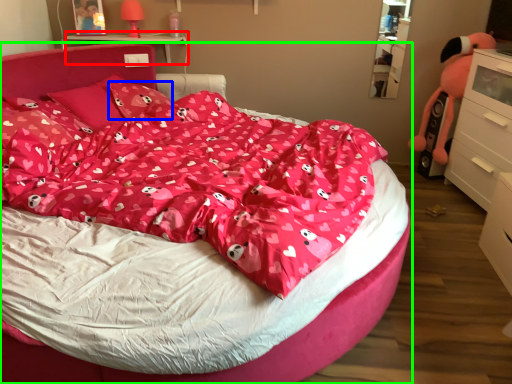
Question: Which is nearer to the table (highlighted by a red box)? pillow (highlighted by a blue box) or bed (highlighted by a green box).

Choices:
 (A) pillow
 (B) bed

Answer: (A)